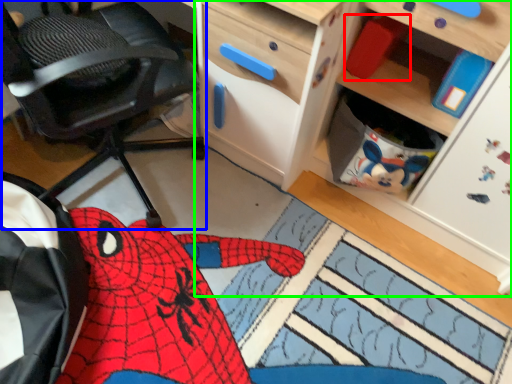
Question: Which is farther away from toy (highlighted by a red box)? chair (highlighted by a blue box) or cabinetry (highlighted by a green box)?

Choices:
 (A) chair
 (B) cabinetry

Answer: (A)